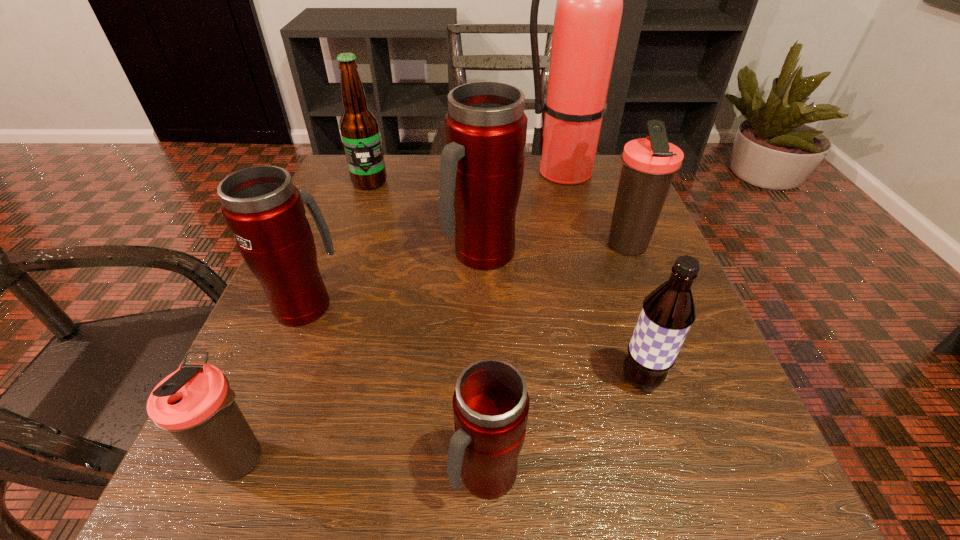
You are a GUI agent. You are given a task and a screenshot of the screen. Output one action in this format:
    pyautogui.click(x=<x>, y=<y>)
    Task: Click on the vacant region between the fire extinguisher and the left brown thermos bottle
    This screenshot has height=540, width=960.
    Given the screenshot: What is the action you would take?
    pyautogui.click(x=405, y=315)

Locate an element on the screen. Image resolution: width=960 pixels, height=540 pixels. vacant space that is in between the smaller brown thermos bottle and the smallest red thermos bottle is located at coordinates (364, 466).

Where is `vacant space that is in between the smaller brown thermos bottle and the tallest thermos bottle`? vacant space that is in between the smaller brown thermos bottle and the tallest thermos bottle is located at coordinates (362, 356).

Locate an element on the screen. The image size is (960, 540). vacant point located between the right brown thermos bottle and the tallest thermos bottle is located at coordinates (553, 249).

Find the location of a particular element. free space between the root beer and the fifth farthest object is located at coordinates (473, 341).

The image size is (960, 540). In order to click on vacant area that lies between the nearer brown thermos bottle and the tallest object in this screenshot , I will do `click(405, 315)`.

At what (x,y) coordinates should I click in order to perform the action: click on vacant space in between the second farthest red thermos bottle and the fire extinguisher. Please return your answer as a coordinate pair (x, y). The height and width of the screenshot is (540, 960). Looking at the image, I should click on (437, 238).

Image resolution: width=960 pixels, height=540 pixels. What are the coordinates of `vacant area that lies between the tallest object and the brown root beer` in the screenshot? It's located at (604, 275).

Identify which object is located as the fifth nearest to the left brown thermos bottle. Please provide its 2D coordinates. Your answer should be formatted as a tuple, i.e. [(x, y)], where the tuple contains the x and y coordinates of a point satisfying the conditions above.

[(359, 127)]

Select which object appears as the second closest to the beer bottle. Please provide its 2D coordinates. Your answer should be formatted as a tuple, i.e. [(x, y)], where the tuple contains the x and y coordinates of a point satisfying the conditions above.

[(264, 210)]